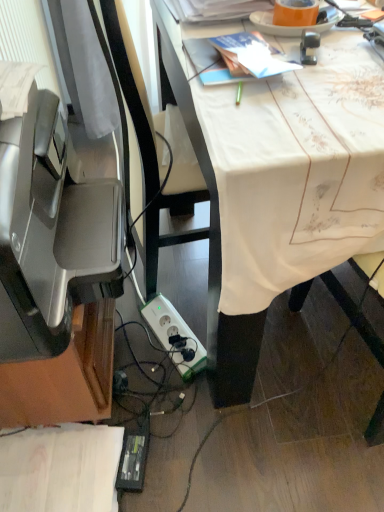
Question: Considering the positions of white plastic power plugs and sockets at lower center and satin silver printer at left in the image, is white plastic power plugs and sockets at lower center wider or thinner than satin silver printer at left?

Choices:
 (A) wide
 (B) thin

Answer: (B)

Question: From a real-world perspective, is white plastic power plugs and sockets at lower center physically located above or below satin silver printer at left?

Choices:
 (A) above
 (B) below

Answer: (B)

Question: Which is farther from the white plastic power plugs and sockets at lower center?

Choices:
 (A) white cloth-covered desk at center
 (B) satin silver printer at left

Answer: (B)

Question: Which of these objects is positioned closest to the satin silver printer at left?

Choices:
 (A) white plastic power plugs and sockets at lower center
 (B) white cloth-covered desk at center

Answer: (B)